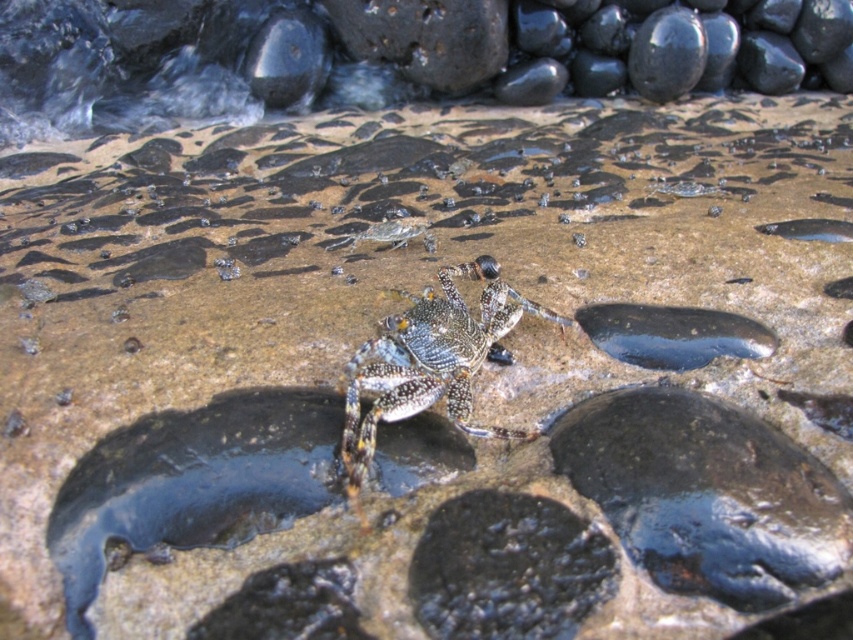
Question: Which point appears farthest from the camera in this image?

Choices:
 (A) (431, 340)
 (B) (392, 246)

Answer: (B)

Question: Which point is farther to the camera?

Choices:
 (A) click(x=590, y=332)
 (B) click(x=386, y=224)
 (C) click(x=465, y=356)

Answer: (B)

Question: Can you confirm if sparkling metallic crab at center is smaller than glossy dark blue puddle at center right?

Choices:
 (A) no
 (B) yes

Answer: (A)

Question: From the image, what is the correct spatial relationship of glossy dark blue puddle at center right in relation to shiny metallic crab at center?

Choices:
 (A) left
 (B) right

Answer: (B)

Question: Based on their relative distances, which object is nearer to the sparkling metallic crab at center?

Choices:
 (A) shiny metallic crab at center
 (B) glossy dark blue puddle at center right

Answer: (B)

Question: Is glossy dark blue puddle at center right positioned at the back of shiny metallic crab at center?

Choices:
 (A) no
 (B) yes

Answer: (A)